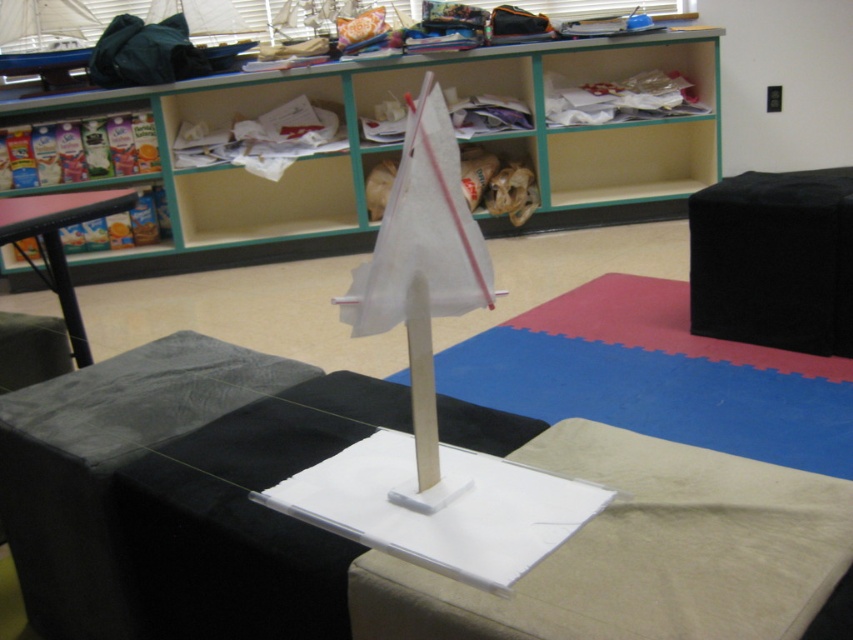
You are a student standing in the classroom and want to reach the wooden bookshelf at upper center to grab a book. If your arm can extend 1.5 meters, can you reach it?

The wooden bookshelf at upper center is 3.65 meters from camera, which is farther than your arm can extend. You cannot reach it.

In the scene shown: You are trying to place a large rectangular box that is 1 meter in width. You have two options for placement in the classroom scene described. The first option is on the blue rubber mat at center, and the second option is on the black fabric stool at center. Based on their sizes, which location would be more suitable for placing the box?

The blue rubber mat at center might be wider than the black fabric stool at center, so placing the large rectangular box on the blue rubber mat at center would be more suitable since it has a larger surface area to accommodate the box.

You are a student who needs to place a 30 cm long ruler between the blue rubber mat at center and the black fabric stool at center. Can you fit the ruler between them without it overlapping either object?

The distance between the blue rubber mat at center and the black fabric stool at center is 41.13 centimeters. Since the ruler is 30 cm long, it can fit between them as the space is wider than the ruler.